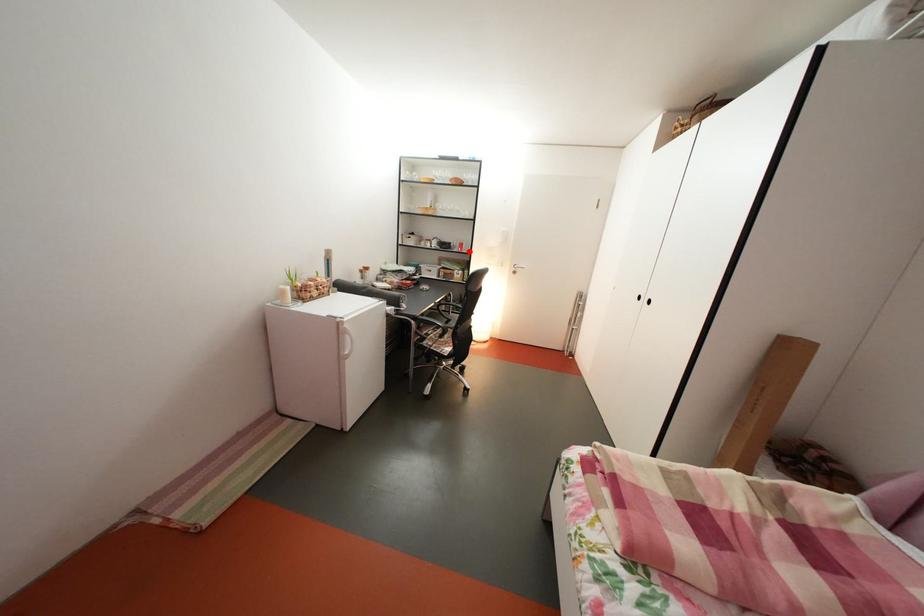
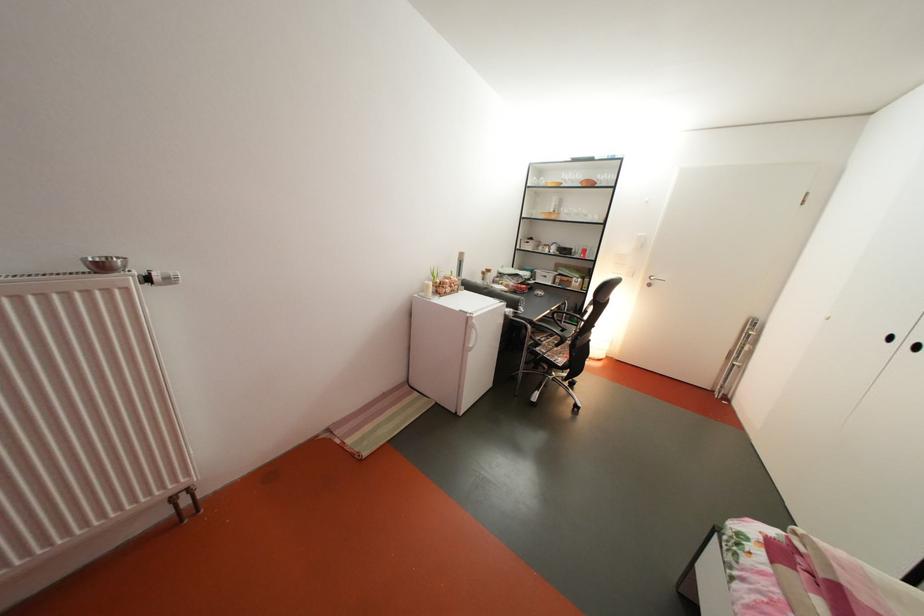
The point at the highlighted location is marked in the first image. Where is the corresponding point in the second image?

(591, 257)